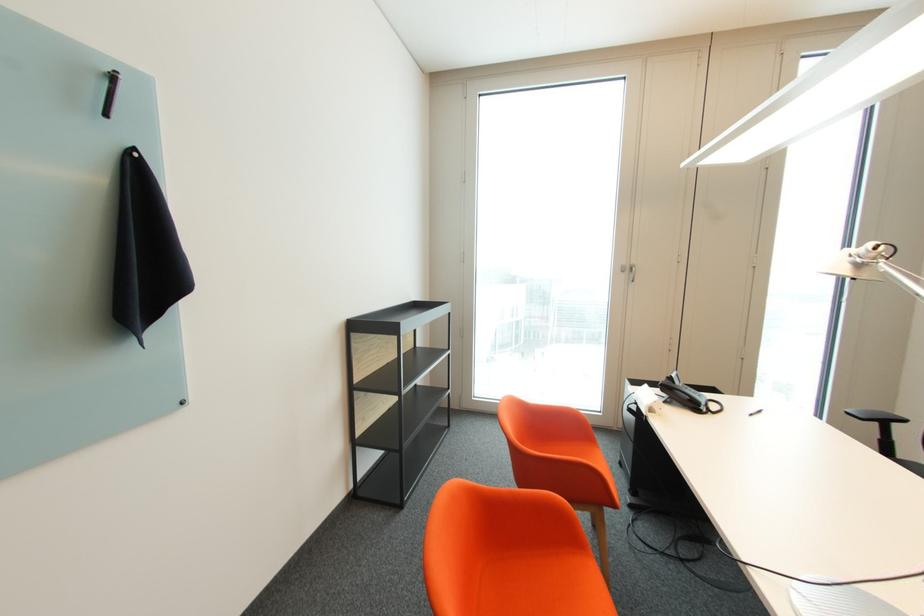
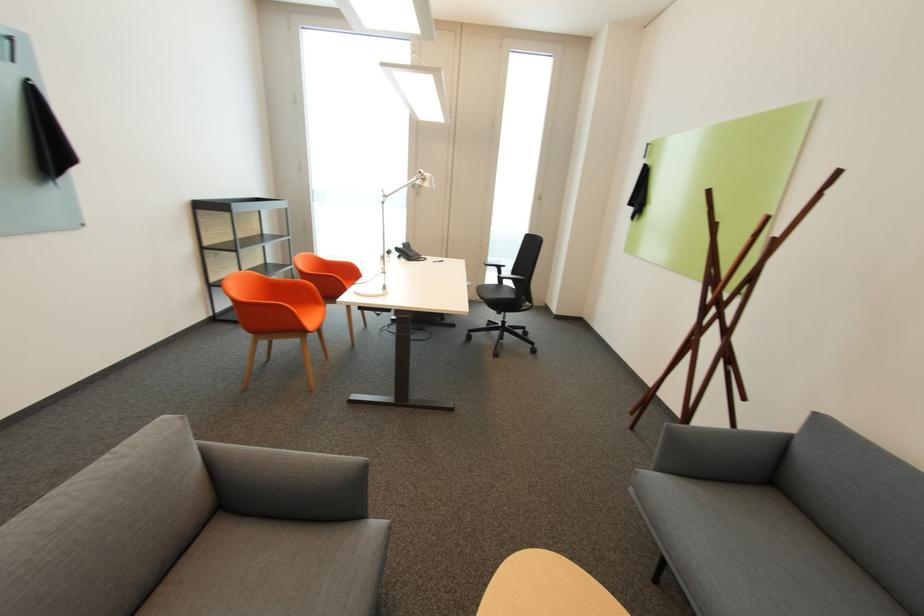
The point at (882, 424) is marked in the first image. Where is the corresponding point in the second image?

(503, 269)